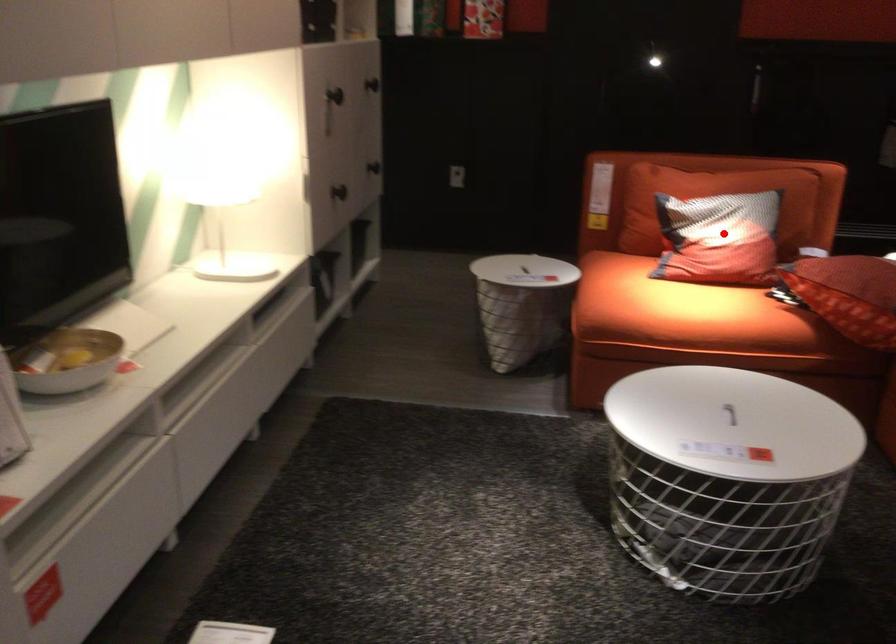
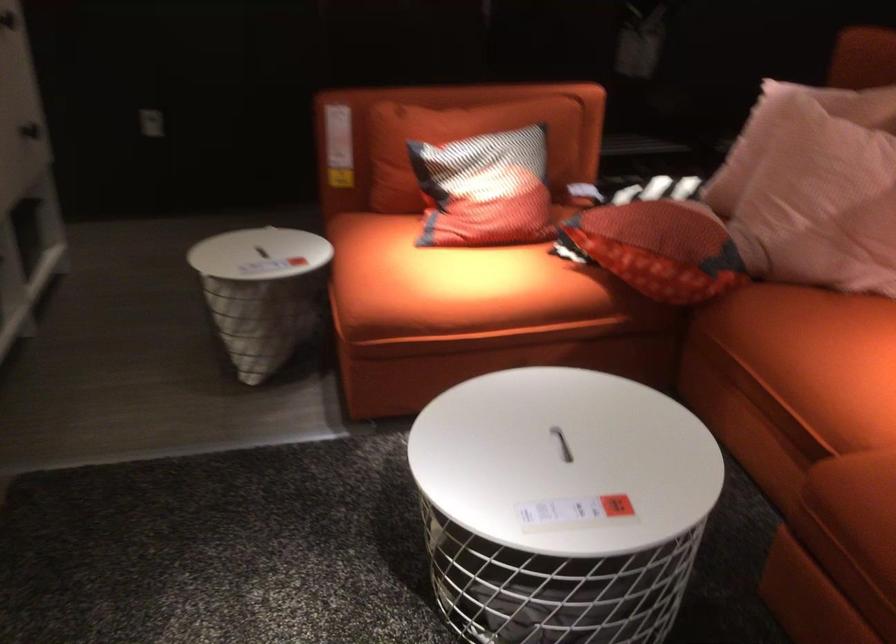
Question: I am providing you with two images of the same scene from different viewpoints. In image1, a red point is highlighted. Considering the same 3D point in image2, which of the following is correct?

Choices:
 (A) It is closer
 (B) It is farther

Answer: (A)